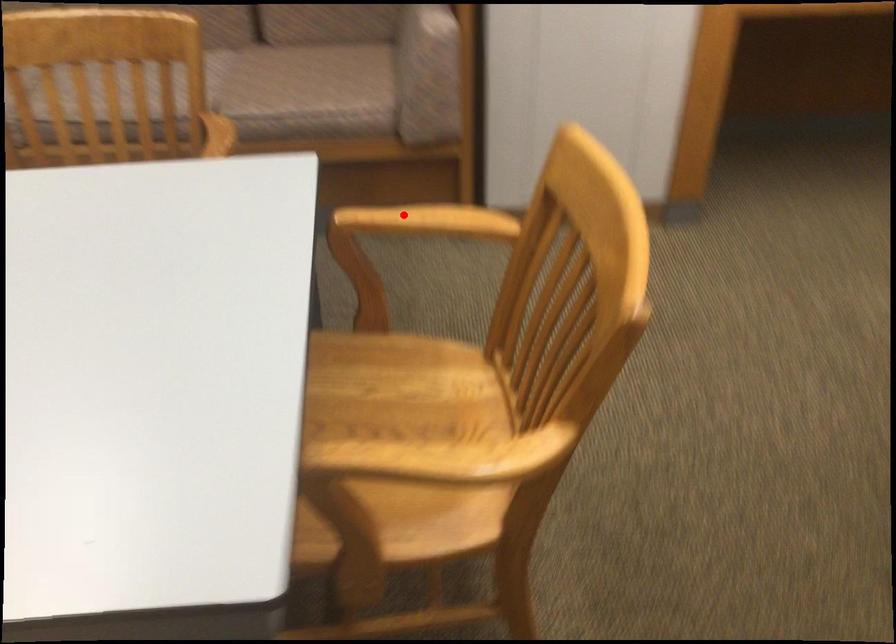
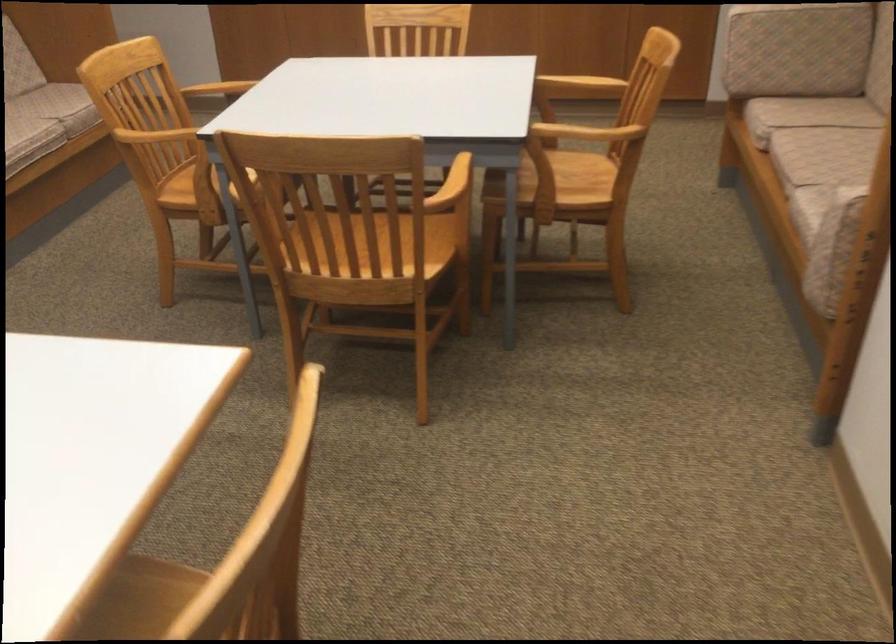
Locate, in the second image, the point that corresponds to the highlighted location in the first image.

(470, 174)